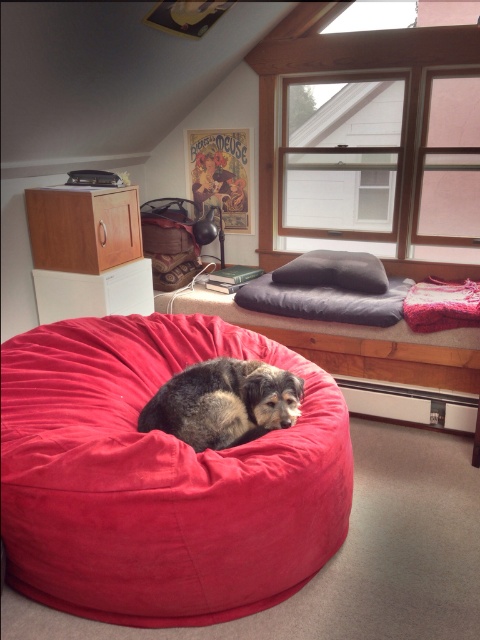
Question: Which point is closer to the camera taking this photo?

Choices:
 (A) (331, 266)
 (B) (160, 205)

Answer: (A)

Question: Where is suede-like red bean bag at center located in relation to dark gray plush pillow at upper center in the image?

Choices:
 (A) right
 (B) left

Answer: (B)

Question: Does suede-like red bean bag at center have a lesser width compared to dark gray plush pillow at upper center?

Choices:
 (A) yes
 (B) no

Answer: (B)

Question: Which point appears farthest from the camera in this image?

Choices:
 (A) (187, 221)
 (B) (283, 538)
 (C) (299, 305)

Answer: (A)

Question: Among these objects, which one is nearest to the camera?

Choices:
 (A) fluffy brown dog at center
 (B) suede-like red bean bag at center
 (C) dark gray plush pillow at upper center
 (D) velvet dark gray cat bed at upper center

Answer: (B)

Question: Can you confirm if suede-like red bean bag at center is positioned to the right of suede bean bag chair at upper center?

Choices:
 (A) yes
 (B) no

Answer: (A)